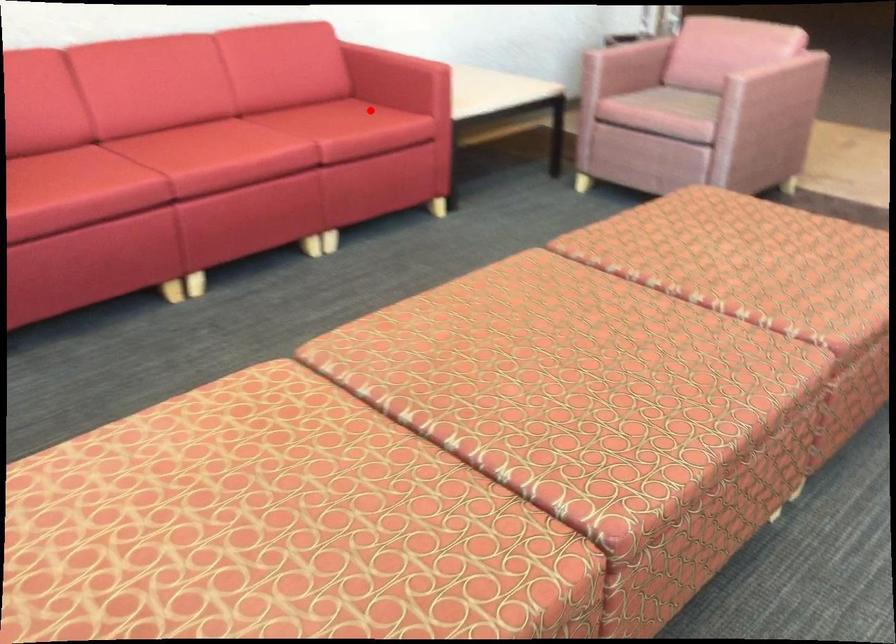
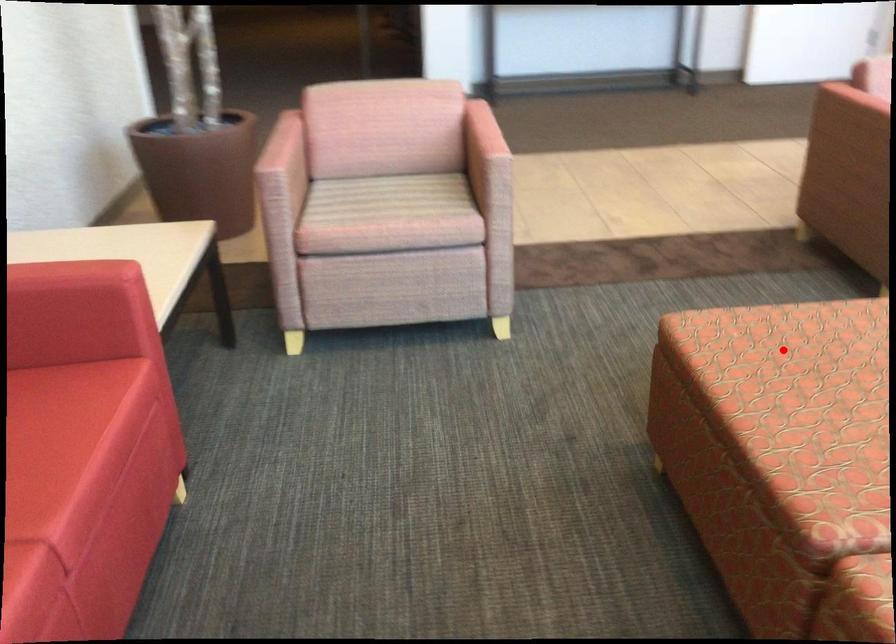
I am providing you with two images of the same scene from different viewpoints. A red point is marked on the first image and another point is marked on the second image. Is the marked point in image1 the same physical position as the marked point in image2?

No